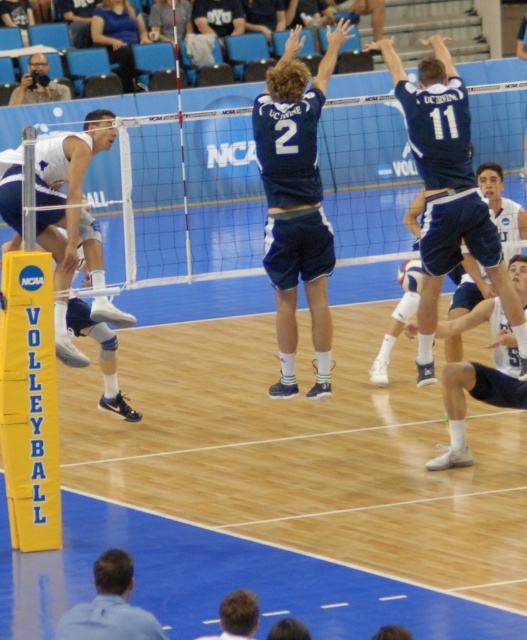
Find the location of a particular element. white mesh net at center is located at coordinates (184, 196).

Is point (213, 225) more distant than point (28, 61)?

No, it is not.

Identify the location of white mesh net at center. (184, 196).

Does blue jersey at upper right have a smaller size compared to black camera at upper left?

Actually, blue jersey at upper right might be larger than black camera at upper left.

Is point (515, 292) farther from camera compared to point (56, 90)?

No, (515, 292) is closer to viewer.

What are the coordinates of `blue jersey at upper right` in the screenshot? It's located at (446, 193).

Who is more distant from viewer, (483, 243) or (492, 316)?

The point (492, 316) is more distant.

Can you confirm if blue jersey at upper right is smaller than blue athletic shorts at lower right?

Actually, blue jersey at upper right might be larger than blue athletic shorts at lower right.

Image resolution: width=527 pixels, height=640 pixels. I want to click on blue jersey at upper right, so click(446, 193).

This screenshot has height=640, width=527. In order to click on blue jersey at upper right in this screenshot , I will do `click(446, 193)`.